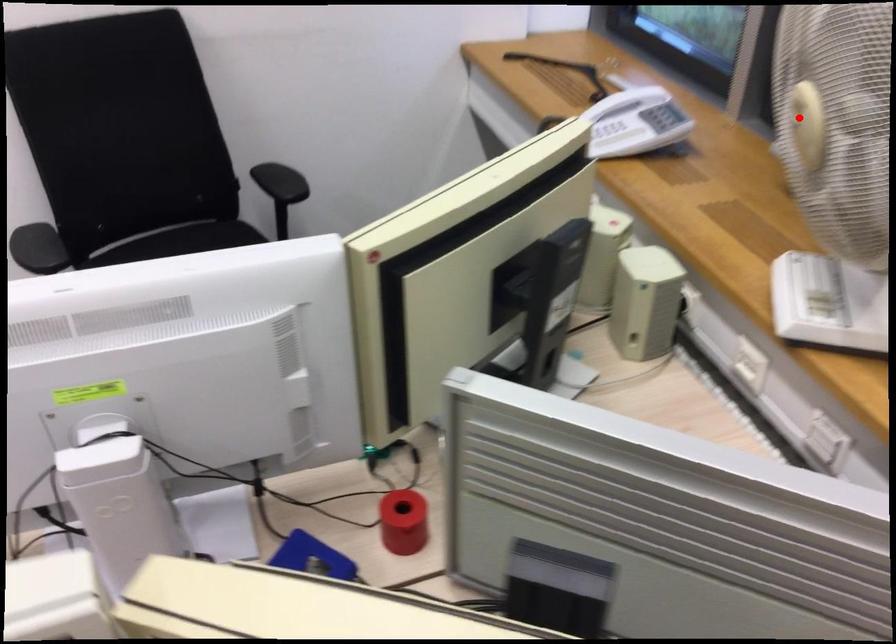
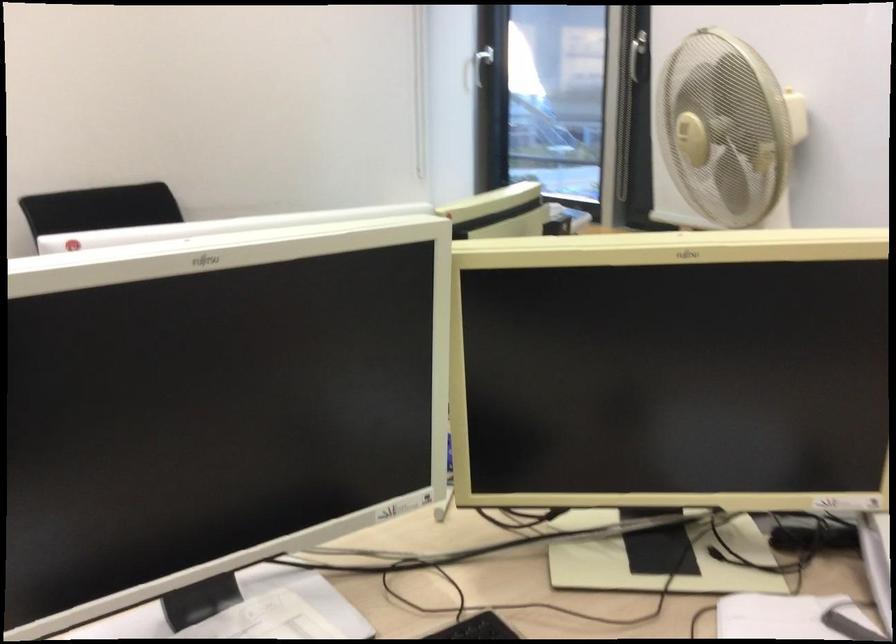
The point at the highlighted location is marked in the first image. Where is the corresponding point in the second image?

(685, 129)